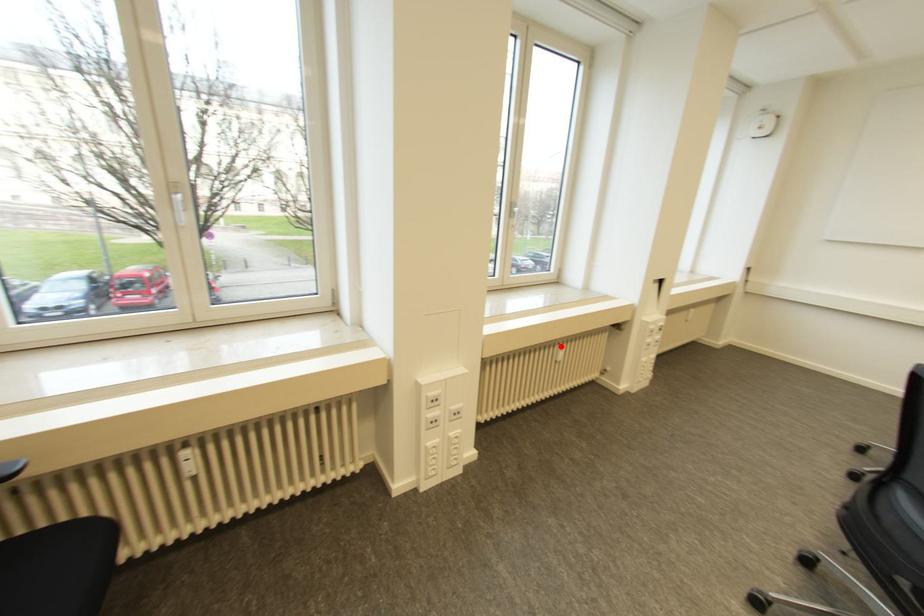
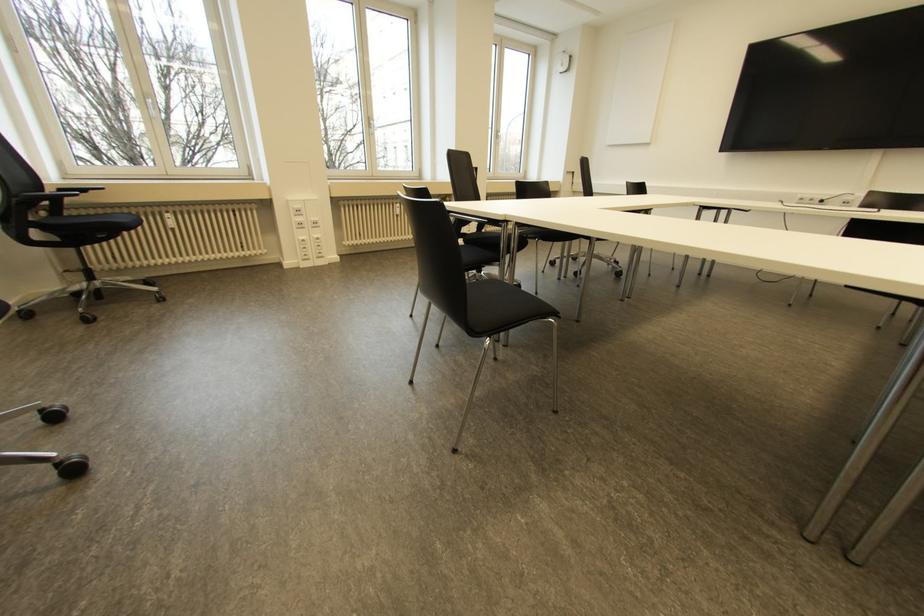
Question: A red point is marked in image1. In image2, is the corresponding 3D point closer to the camera or farther? Reply with the corresponding letter.

Choices:
 (A) The corresponding 3D point is closer.
 (B) The corresponding 3D point is farther.

Answer: (A)